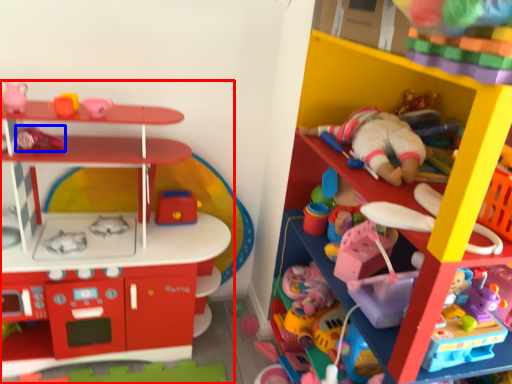
Question: Which object appears closest to the camera in this image, toy (highlighted by a red box) or toy (highlighted by a blue box)?

Choices:
 (A) toy
 (B) toy

Answer: (A)